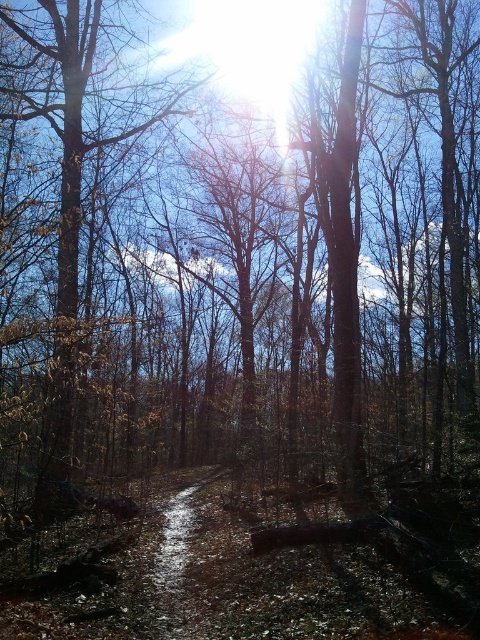
Is brown wood tree at center positioned in front of damp dirt trail at center?

Yes.

Consider the image. Is brown wood tree at center positioned behind damp dirt trail at center?

No.

In order to click on brown wood tree at center in this screenshot , I will do `click(68, 211)`.

The width and height of the screenshot is (480, 640). In order to click on brown wood tree at center in this screenshot , I will do `click(68, 211)`.